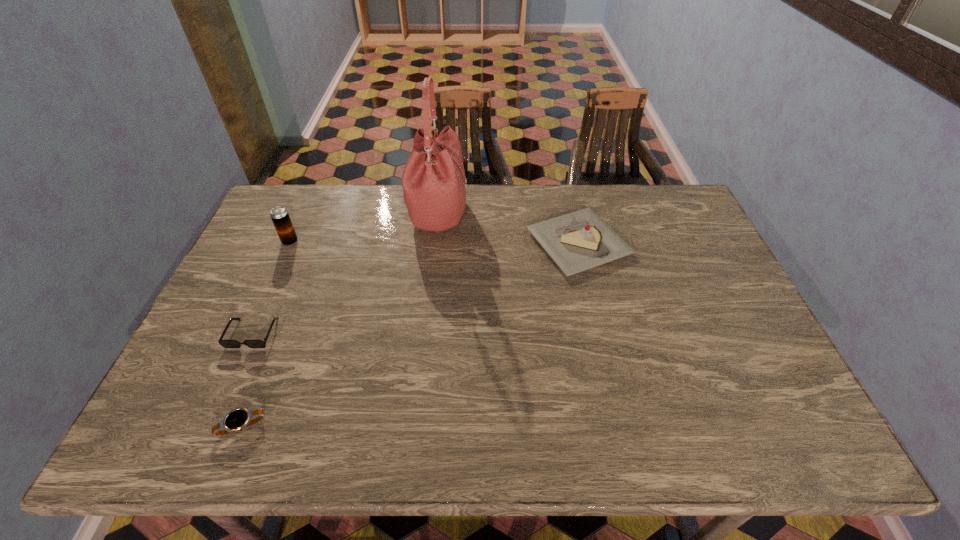
Where is `vacant space situated on the front-facing side of the sunglasses`? Image resolution: width=960 pixels, height=540 pixels. vacant space situated on the front-facing side of the sunglasses is located at coordinates (225, 397).

Image resolution: width=960 pixels, height=540 pixels. I want to click on free space located 0.050m on the left of the watch, so click(197, 427).

The height and width of the screenshot is (540, 960). I want to click on handbag present at the far edge, so click(434, 184).

Identify the location of cake present at the far edge. Image resolution: width=960 pixels, height=540 pixels. (578, 241).

Identify the location of object present at the near edge. (236, 420).

At what (x,y) coordinates should I click in order to perform the action: click on beer can that is at the left edge. Please return your answer as a coordinate pair (x, y). Looking at the image, I should click on (280, 217).

The height and width of the screenshot is (540, 960). What are the coordinates of `sunglasses situated at the left edge` in the screenshot? It's located at (225, 343).

This screenshot has width=960, height=540. Identify the location of watch that is at the left edge. (236, 420).

Where is `object that is at the near left corner`? object that is at the near left corner is located at coordinates (236, 420).

At what (x,y) coordinates should I click in order to perform the action: click on free space at the far edge. Please return your answer as a coordinate pair (x, y). The width and height of the screenshot is (960, 540). Looking at the image, I should click on (478, 198).